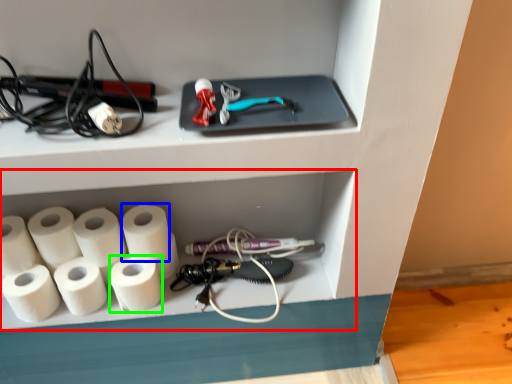
Question: Which is farther away from shelf (highlighted by a red box)? paper towel (highlighted by a blue box) or paper towel (highlighted by a green box)?

Choices:
 (A) paper towel
 (B) paper towel

Answer: (B)